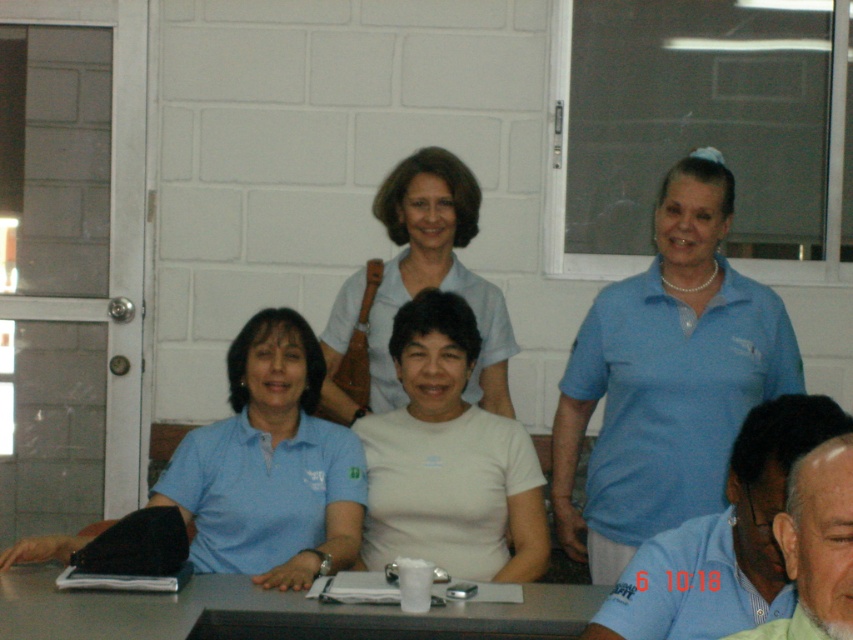
You are organizing a meeting and need to seat participants in order of arrival. The person in the green shirt at lower right arrived later than the one in the blue shirt at center. Based on their positions in the image, who should be seated first?

The blue shirt at center should be seated first because the green shirt at lower right is behind them, indicating they arrived later.

You are organizing a team meeting and need to ensure everyone has enough space. You notice the white matte shirt at center and the blue shirt at center are seated next to each other. Which person requires more space due to their clothing size?

The white matte shirt at center requires more space because its width surpasses that of the blue shirt at center.

You are organizing a team meeting and need to know the seating arrangement. Which team member is positioned lower between the matte blue polo shirt at upper right and the light blue shirt at center?

The matte blue polo shirt at upper right is located below the light blue shirt at center, so the matte blue polo shirt at upper right is positioned lower.